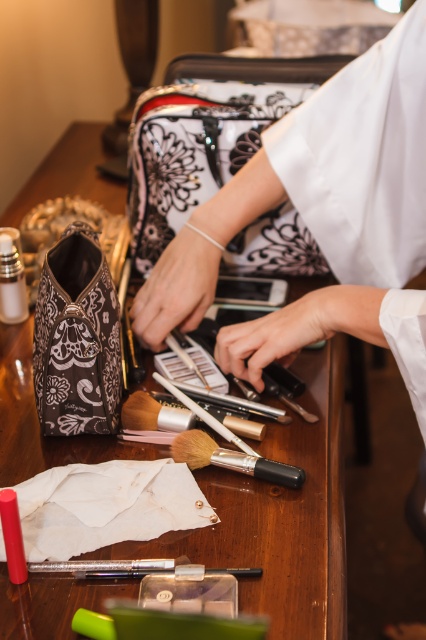
Which of these two, wooden table at center or black matte brush at center, stands shorter?

Standing shorter between the two is black matte brush at center.

Who is positioned more to the right, wooden table at center or black matte brush at center?

Positioned to the right is black matte brush at center.

Is point (81, 442) positioned in front of point (250, 472)?

That is False.

This screenshot has width=426, height=640. Find the location of `wooden table at center`. wooden table at center is located at coordinates 279,516.